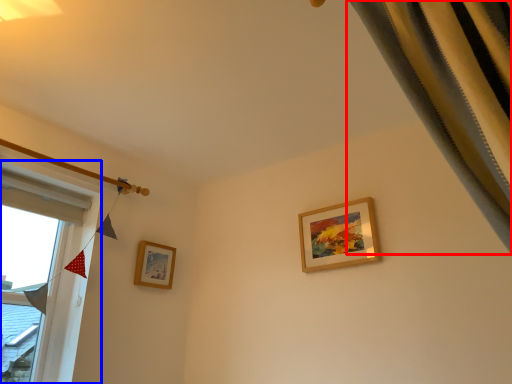
Question: Which of the following is the closest to the observer, curtain (highlighted by a red box) or window (highlighted by a blue box)?

Choices:
 (A) curtain
 (B) window

Answer: (A)